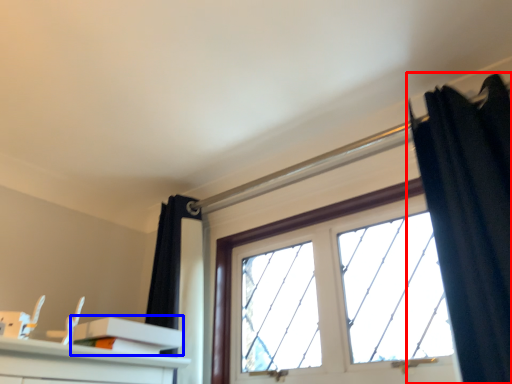
Question: Among these objects, which one is nearest to the camera, curtain (highlighted by a red box) or shelf (highlighted by a blue box)?

Choices:
 (A) curtain
 (B) shelf

Answer: (A)